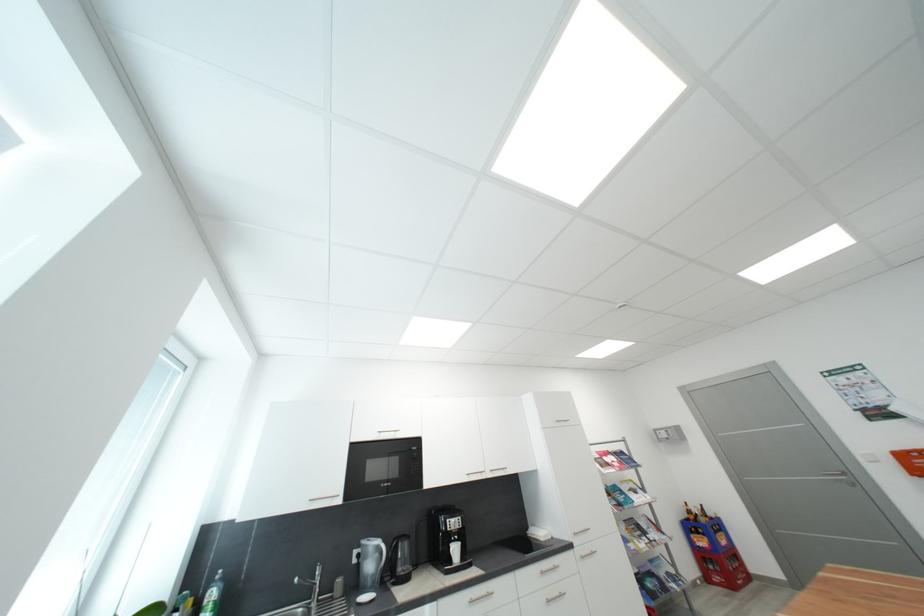
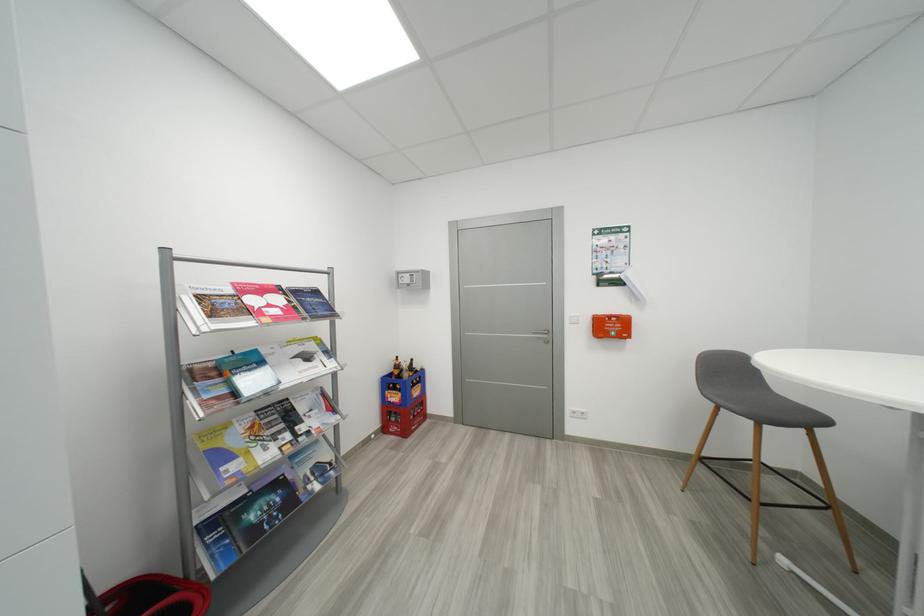
Find the pixel in the second image that matches (651,541) in the first image.

(294, 438)